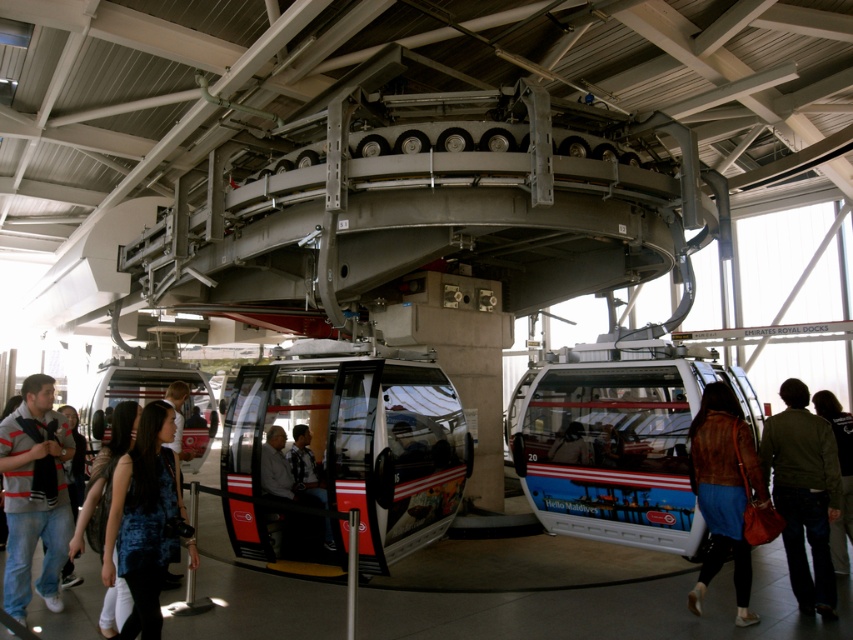
Looking at this image, between blue denim jeans at lower left and dark green jacket at lower right, which one is positioned higher?

blue denim jeans at lower left is above.

Who is more distant from viewer, (132,406) or (844,464)?

Point (844,464)

This screenshot has height=640, width=853. Find the location of `blue denim jeans at lower left`. blue denim jeans at lower left is located at coordinates (105, 467).

The height and width of the screenshot is (640, 853). Describe the element at coordinates (804, 493) in the screenshot. I see `green fabric jacket at lower right` at that location.

Which is in front, point (769, 460) or point (151, 566)?

Point (151, 566)

Is point (801, 444) positioned in front of point (155, 422)?

No, (801, 444) is further to viewer.

At what (x,y) coordinates should I click in order to perform the action: click on green fabric jacket at lower right. Please return your answer as a coordinate pair (x, y). This screenshot has height=640, width=853. Looking at the image, I should click on (804, 493).

Does brown leather jacket at lower right have a larger size compared to blue textured shirt at center?

Yes.

Does brown leather jacket at lower right have a greater width compared to blue textured shirt at center?

Yes.

Image resolution: width=853 pixels, height=640 pixels. Find the location of `brown leather jacket at lower right`. brown leather jacket at lower right is located at coordinates (723, 492).

What are the coordinates of `brown leather jacket at lower right` in the screenshot? It's located at (723, 492).